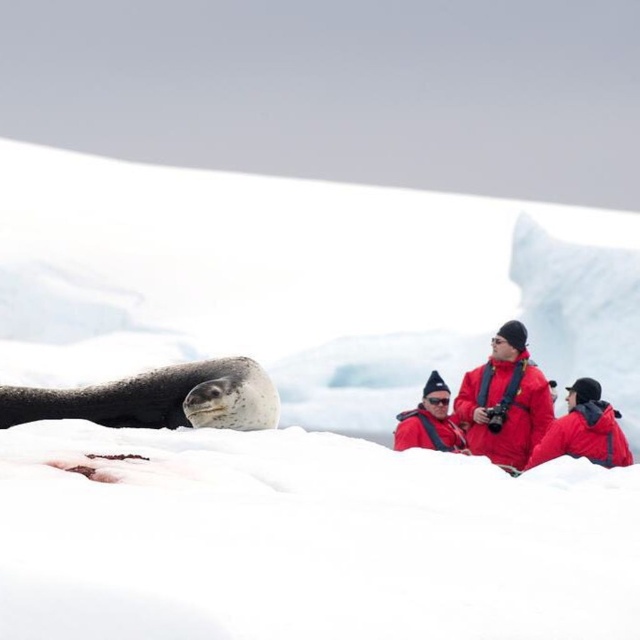
Question: Which object is the closest to the red down jacket at center?

Choices:
 (A) red matte jacket at center
 (B) matte red jacket at center

Answer: (B)

Question: Considering the real-world distances, which object is closest to the red matte jacket at center?

Choices:
 (A) speckled fur seal at lower left
 (B) red down jacket at center
 (C) matte red jacket at center

Answer: (B)

Question: Does speckled fur seal at lower left have a smaller size compared to matte red jacket at center?

Choices:
 (A) yes
 (B) no

Answer: (B)

Question: Considering the real-world distances, which object is closest to the speckled fur seal at lower left?

Choices:
 (A) red matte jacket at center
 (B) matte red jacket at center
 (C) red down jacket at center

Answer: (C)

Question: Is speckled fur seal at lower left bigger than red down jacket at center?

Choices:
 (A) no
 (B) yes

Answer: (A)

Question: Does speckled fur seal at lower left appear under red down jacket at center?

Choices:
 (A) yes
 (B) no

Answer: (B)